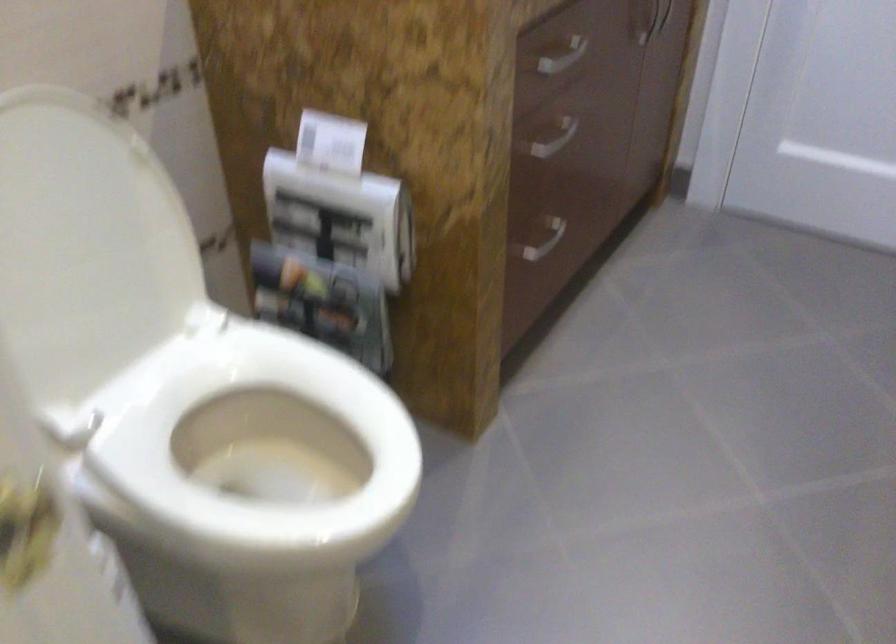
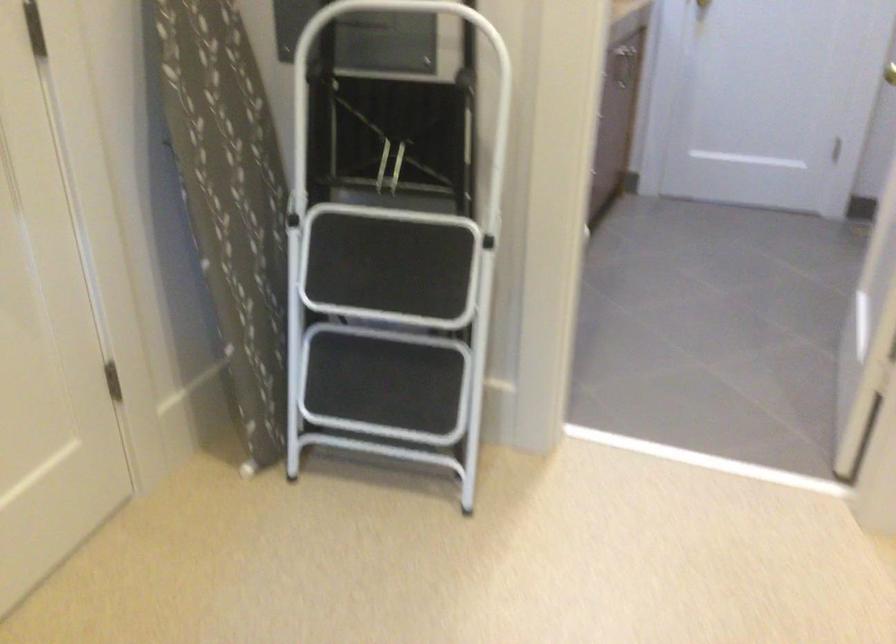
Question: I am providing you with two images of the same scene from different viewpoints. Please identify which objects are invisible in image2.

Choices:
 (A) black audio knob
 (B) white stool handle
 (C) gold door handle
 (D) white toilet lid

Answer: (D)